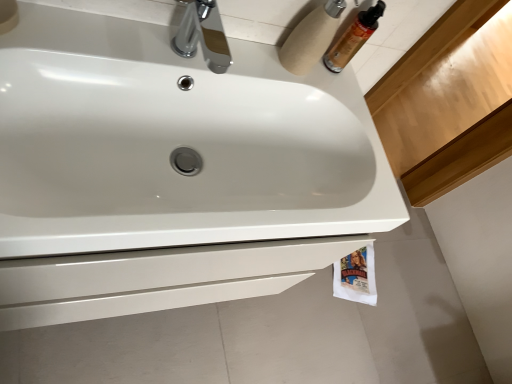
Question: Is white cardboard toilet paper at upper right, placed as the second toilet paper when sorted from bottom to top, facing away from white glossy sink at center?

Choices:
 (A) no
 (B) yes

Answer: (A)

Question: From the image's perspective, is white cardboard toilet paper at upper right, placed as the 2th toilet paper when sorted from back to front, above white glossy sink at center?

Choices:
 (A) no
 (B) yes

Answer: (B)

Question: Is white cardboard toilet paper at upper right, placed as the 2th toilet paper when sorted from back to front, taller than white glossy sink at center?

Choices:
 (A) no
 (B) yes

Answer: (B)

Question: Is white cardboard toilet paper at upper right, placed as the 2th toilet paper when sorted from back to front, at the right side of white glossy sink at center?

Choices:
 (A) no
 (B) yes

Answer: (B)

Question: Is white glossy sink at center inside white cardboard toilet paper at upper right, which is the 2th toilet paper from right to left?

Choices:
 (A) no
 (B) yes

Answer: (A)

Question: Is translucent plastic mouthwash at upper right wider or thinner than chrome metallic faucet at upper center?

Choices:
 (A) wide
 (B) thin

Answer: (B)

Question: Visually, is translucent plastic mouthwash at upper right positioned to the left or to the right of chrome metallic faucet at upper center?

Choices:
 (A) right
 (B) left

Answer: (A)

Question: Considering their positions, is translucent plastic mouthwash at upper right located in front of or behind chrome metallic faucet at upper center?

Choices:
 (A) behind
 (B) front

Answer: (A)

Question: Is translucent plastic mouthwash at upper right bigger or smaller than chrome metallic faucet at upper center?

Choices:
 (A) big
 (B) small

Answer: (B)

Question: From a real-world perspective, is white glossy sink at center physically located above or below white paper towel at lower right, marked as the second toilet paper in a front-to-back arrangement?

Choices:
 (A) below
 (B) above

Answer: (B)

Question: Is point (263, 235) closer or farther from the camera than point (361, 259)?

Choices:
 (A) farther
 (B) closer

Answer: (B)

Question: From their relative heights in the image, would you say white glossy sink at center is taller or shorter than white paper towel at lower right, acting as the first toilet paper starting from the back?

Choices:
 (A) short
 (B) tall

Answer: (B)

Question: Looking at their shapes, would you say white glossy sink at center is wider or thinner than white paper towel at lower right, the 1th toilet paper when ordered from right to left?

Choices:
 (A) thin
 (B) wide

Answer: (B)

Question: Is white glossy sink at center spatially inside white cardboard toilet paper at upper right, arranged as the 1th toilet paper when viewed from the front, or outside of it?

Choices:
 (A) outside
 (B) inside

Answer: (A)

Question: In terms of height, does white glossy sink at center look taller or shorter compared to white cardboard toilet paper at upper right, which is the 1th toilet paper in top-to-bottom order?

Choices:
 (A) tall
 (B) short

Answer: (B)